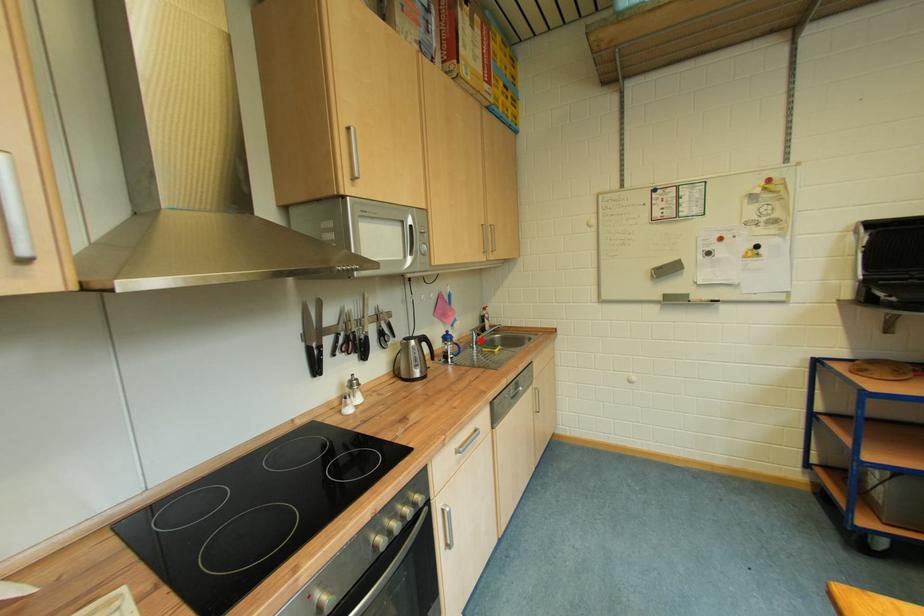
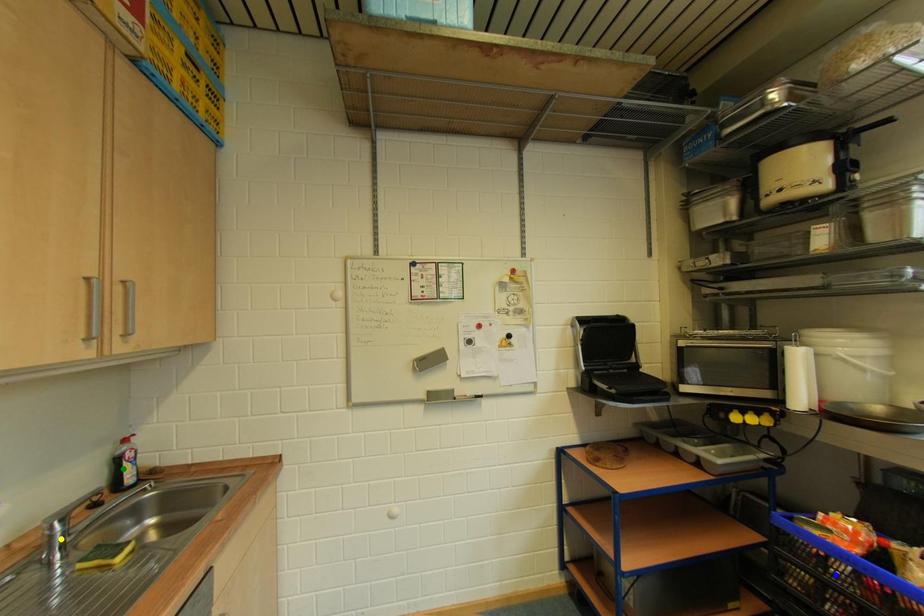
Question: I am providing you with two images of the same scene from different viewpoints. A red point is marked on the first image. You are given multiple points on the second image. In image 2, which mark is for the same physical point as the one in image 1?

Choices:
 (A) yellow point
 (B) blue point
 (C) green point

Answer: (A)